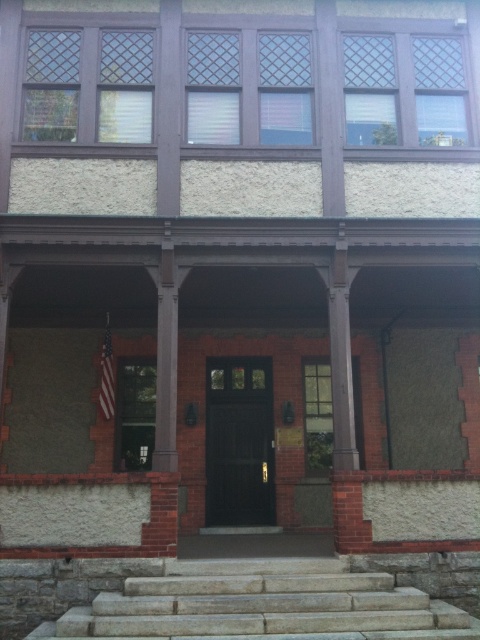
Question: Can you confirm if gray stone stairs at lower center is thinner than shiny dark wood door at center?

Choices:
 (A) no
 (B) yes

Answer: (A)

Question: Among these objects, which one is farthest from the camera?

Choices:
 (A) red fabric american flag at center
 (B) gray stone stairs at lower center

Answer: (A)

Question: Which point is closer to the camera taking this photo?

Choices:
 (A) (107, 417)
 (B) (204, 515)
 (C) (158, 627)

Answer: (C)

Question: Among these objects, which one is nearest to the camera?

Choices:
 (A) shiny dark wood door at center
 (B) gray stone stairs at lower center

Answer: (B)

Question: Does gray stone stairs at lower center appear under shiny dark wood door at center?

Choices:
 (A) yes
 (B) no

Answer: (A)

Question: Does gray stone stairs at lower center appear under shiny dark wood door at center?

Choices:
 (A) no
 (B) yes

Answer: (B)